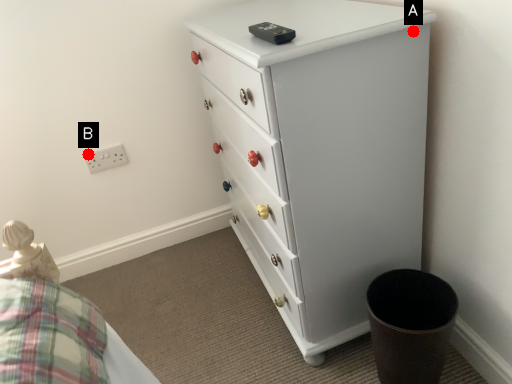
Question: Two points are circled on the image, labeled by A and B beside each circle. Which of the following is the farthest from the observer?

Choices:
 (A) A is further
 (B) B is further

Answer: (B)